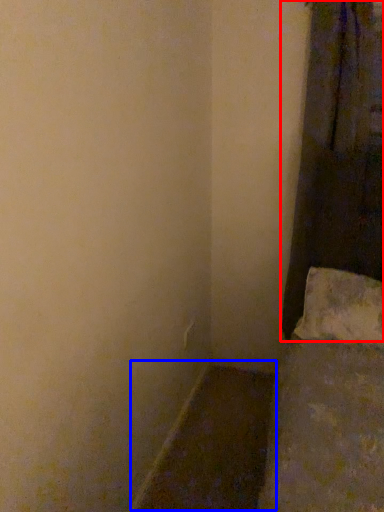
Question: Which object is further to the camera taking this photo, curtain (highlighted by a red box) or window sill (highlighted by a blue box)?

Choices:
 (A) curtain
 (B) window sill

Answer: (A)